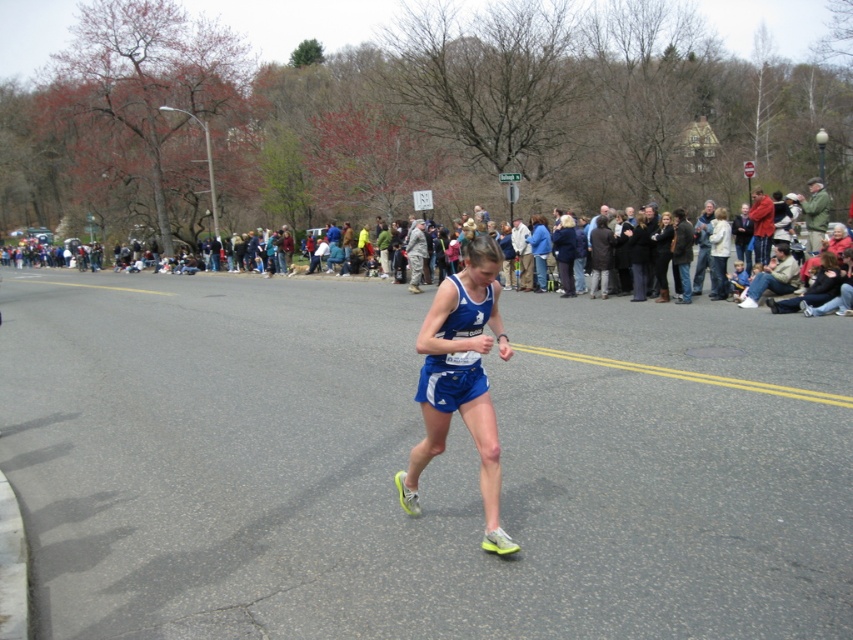
Question: Where is blue fabric shorts at center located in relation to dark clothing crowd at center in the image?

Choices:
 (A) below
 (B) above

Answer: (A)

Question: Observing the image, what is the correct spatial positioning of blue fabric shorts at center in reference to dark clothing crowd at center?

Choices:
 (A) left
 (B) right

Answer: (B)

Question: Among these points, which one is farthest from the camera?

Choices:
 (A) (737, 301)
 (B) (422, 328)

Answer: (A)

Question: Which object is farther from the camera taking this photo?

Choices:
 (A) blue fabric shorts at center
 (B) dark clothing crowd at center

Answer: (B)

Question: Does blue fabric shorts at center come behind dark clothing crowd at center?

Choices:
 (A) yes
 (B) no

Answer: (B)